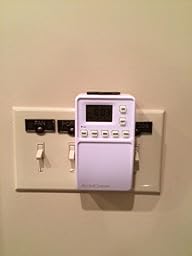
Where is `corners of light switch plate`? corners of light switch plate is located at coordinates (12, 107), (164, 110), (159, 192), (16, 190).